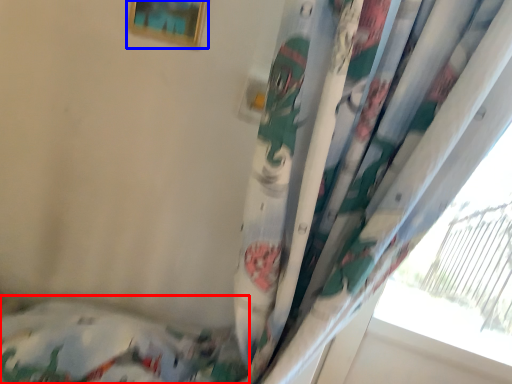
Question: Among these objects, which one is farthest to the camera, bed (highlighted by a red box) or picture frame (highlighted by a blue box)?

Choices:
 (A) bed
 (B) picture frame

Answer: (A)